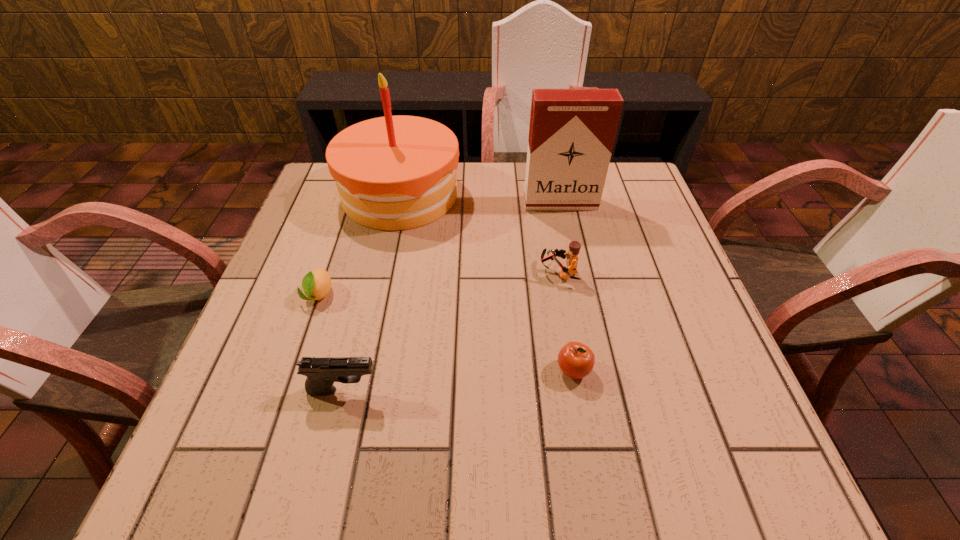
Locate an element on the screen. The width and height of the screenshot is (960, 540). vacant space located 0.390m holding a crossbow in the hands of the Lego is located at coordinates (369, 273).

Locate an element on the screen. free space located 0.140m holding a crossbow in the hands of the Lego is located at coordinates (478, 273).

Identify the location of vacant point located 0.320m on the left of the second shortest object. (385, 370).

Image resolution: width=960 pixels, height=540 pixels. What are the coordinates of `vacant space positioned with leaves positioned above the shortest object` in the screenshot? It's located at tap(279, 408).

Image resolution: width=960 pixels, height=540 pixels. I want to click on birthday cake at the far edge, so click(392, 173).

You are a GUI agent. You are given a task and a screenshot of the screen. Output one action in this format:
    pyautogui.click(x=<x>, y=<y>)
    Task: Click on the cigarette_case that is at the far edge
    
    Given the screenshot: What is the action you would take?
    [x=572, y=131]

Locate an element on the screen. This screenshot has height=540, width=960. birthday cake located at the left edge is located at coordinates (392, 173).

You are a GUI agent. You are given a task and a screenshot of the screen. Output one action in this format:
    pyautogui.click(x=<x>, y=<y>)
    Task: Click on the pistol that is at the left edge
    This screenshot has height=540, width=960.
    Given the screenshot: What is the action you would take?
    pyautogui.click(x=321, y=372)

At what (x,y) coordinates should I click in order to perform the action: click on lemon that is at the left edge. Please return your answer as a coordinate pair (x, y). Looking at the image, I should click on (316, 284).

Find the location of `object located at the right edge`. object located at the right edge is located at coordinates (572, 131).